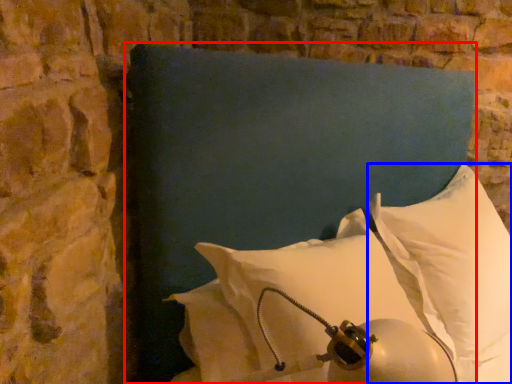
Question: Which of the following is the farthest to the observer, pillow (highlighted by a red box) or pillow (highlighted by a blue box)?

Choices:
 (A) pillow
 (B) pillow

Answer: (B)